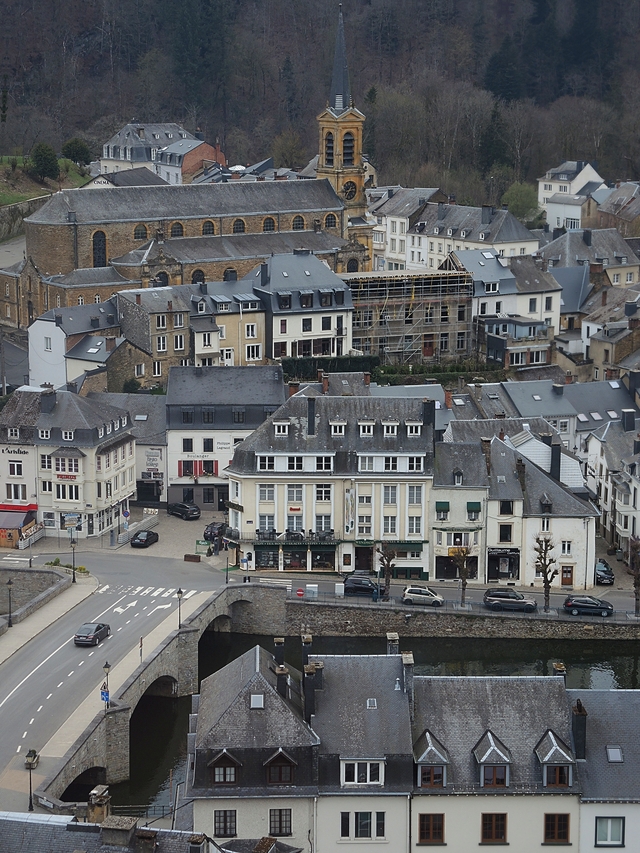
Locate an element on the screen. This screenshot has width=640, height=853. chimneys is located at coordinates (264, 276), (310, 692), (281, 682), (281, 651), (305, 643), (394, 645), (554, 459).